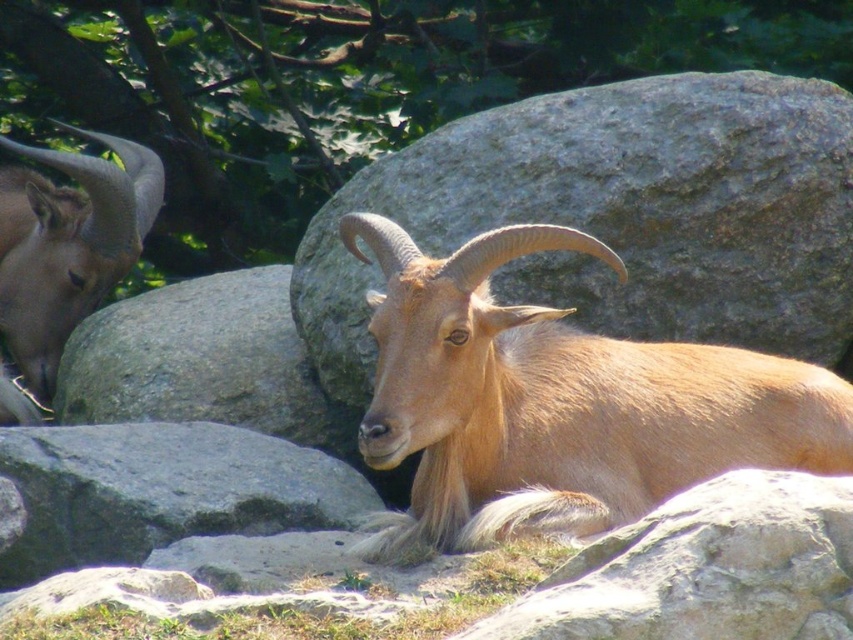
Question: Which is farther from the gray rock at center?

Choices:
 (A) golden fur goat at center
 (B) gray rough rock at lower left

Answer: (A)

Question: Considering the relative positions of gray rough rock at lower right and gray rough rock at lower left in the image provided, where is gray rough rock at lower right located with respect to gray rough rock at lower left?

Choices:
 (A) right
 (B) left

Answer: (A)

Question: Which point is closer to the camera taking this photo?

Choices:
 (A) (88, 237)
 (B) (701, 570)
 (C) (410, 356)

Answer: (B)

Question: Where is golden fur goat at center located in relation to gray rough rock at lower left in the image?

Choices:
 (A) left
 (B) right

Answer: (B)

Question: Can you confirm if golden fur goat at center is bigger than brown woolen goat at left?

Choices:
 (A) no
 (B) yes

Answer: (B)

Question: Considering the real-world distances, which object is farthest from the brown woolen goat at left?

Choices:
 (A) golden fur goat at center
 (B) gray rock at center
 (C) gray rough rock at lower left
 (D) gray rough rock at lower right

Answer: (D)